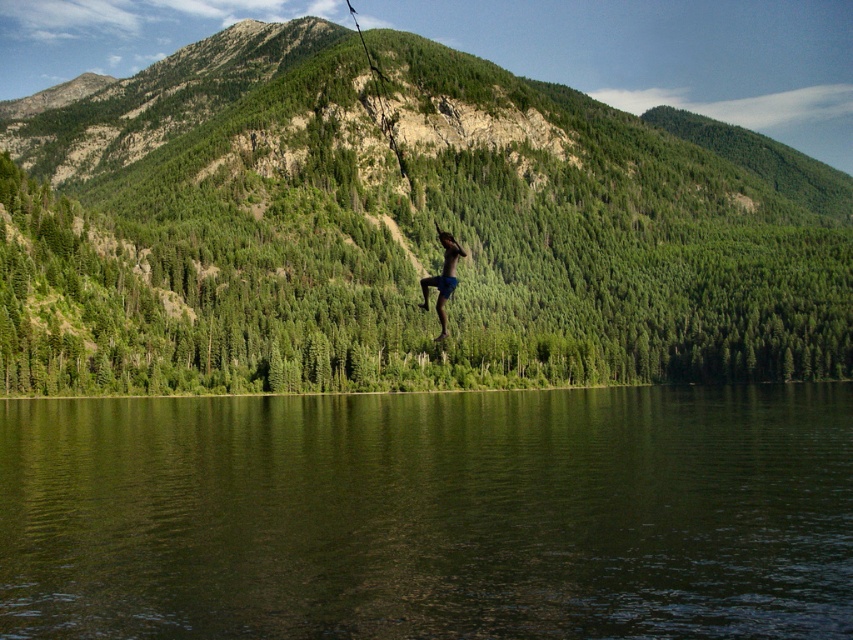
You are standing at the edge of the lake and want to reach the point marked as point (x=53, y=300). If your swimming speed is 1.5 meters per second, how long will it take you to swim to that point?

The point (x=53, y=300) is 158.79 meters away from the viewer. At a swimming speed of 1.5 meters per second, it will take approximately 105.86 seconds, which is about 1 minute and 46 seconds, to reach the point.

Based on the photo, you are a photographer planning to capture a wide shot of the scene. You want to ensure that both the green smooth water at center and the blue denim shorts at center are clearly visible in the frame. Given their sizes, which object will occupy more space in the photograph?

The green smooth water at center will occupy more space in the photograph since its width is larger than that of the blue denim shorts at center.

You are a photographer standing at the edge of the lake. You want to take a photo that includes both the green forested mountain at center and the blue denim shorts at center. Which object should you focus on first to ensure both are in the frame?

You should focus on the green forested mountain at center first because it is closer to you than the blue denim shorts at center, ensuring both are in the frame.